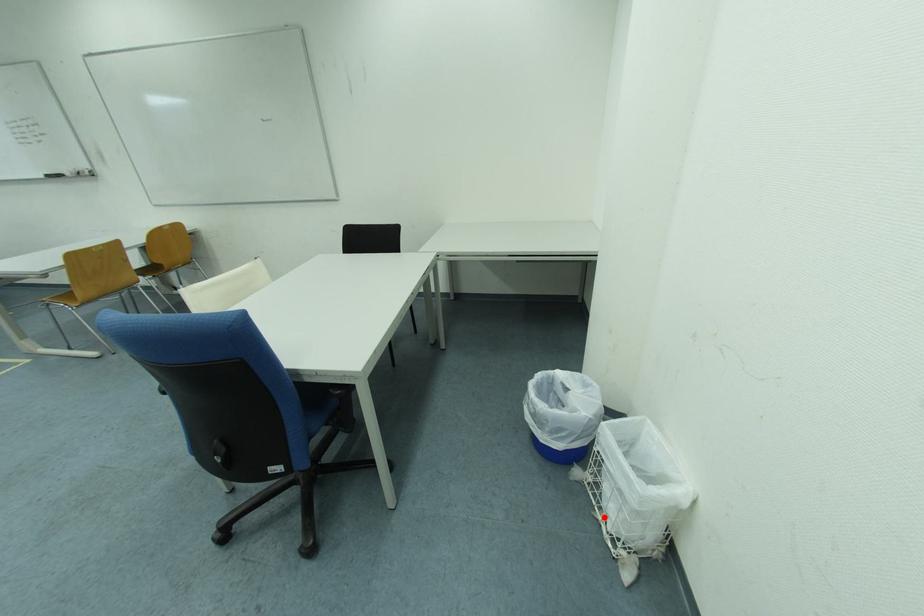
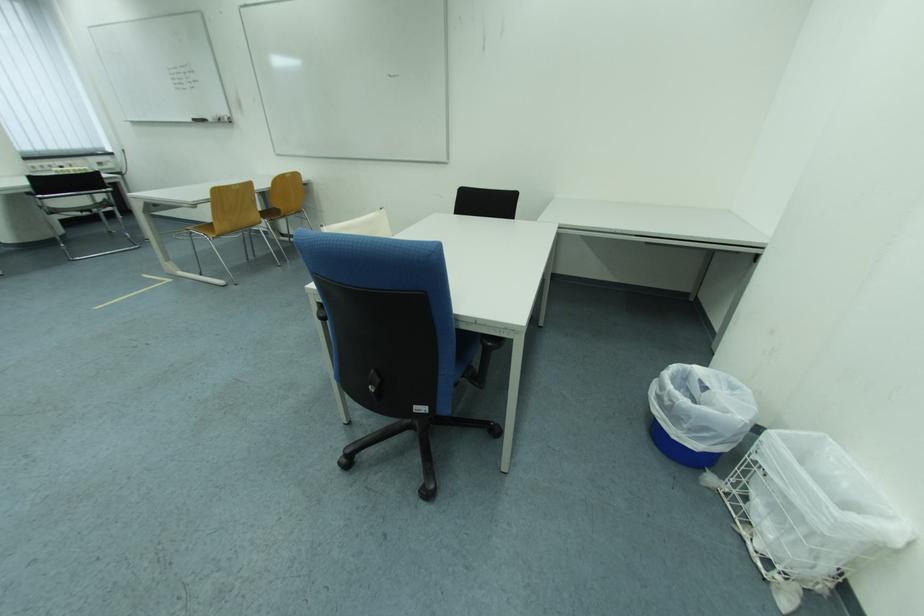
Question: A red point is marked in image1. In image2, is the corresponding 3D point closer to the camera or farther? Reply with the corresponding letter.

Choices:
 (A) The corresponding 3D point is closer.
 (B) The corresponding 3D point is farther.

Answer: (B)